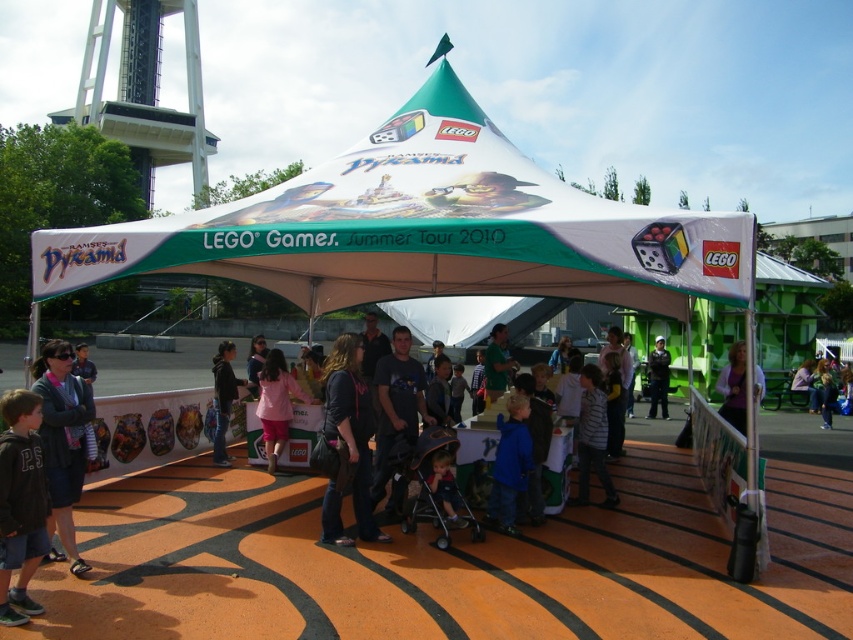
Question: Can you confirm if white fabric canopy at center is positioned to the right of matte pink shirt at center?

Choices:
 (A) yes
 (B) no

Answer: (A)

Question: Which point is closer to the camera?

Choices:
 (A) (497, 456)
 (B) (601, 449)
 (C) (334, 380)
 (D) (738, 356)

Answer: (C)

Question: Estimate the real-world distances between objects in this image. Which object is farther from the black uniform at center?

Choices:
 (A) dark gray hoodie at center
 (B) striped shirt at center

Answer: (A)

Question: Which of these objects is positioned farthest from the dark blue jeans at center?

Choices:
 (A) blonde hair at center
 (B) blue matte shirt at center
 (C) dark gray hoodie at lower left

Answer: (A)

Question: Can you confirm if dark gray hoodie at lower left is positioned below dark gray sweater at lower left?

Choices:
 (A) no
 (B) yes

Answer: (B)

Question: Can you confirm if dark gray hoodie at center is thinner than black uniform at center?

Choices:
 (A) yes
 (B) no

Answer: (A)